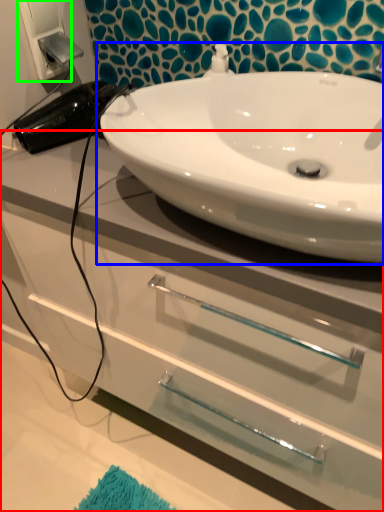
Question: Which object is positioned closest to bathroom cabinet (highlighted by a red box)? Select from sink (highlighted by a blue box) and electric outlet (highlighted by a green box).

Choices:
 (A) sink
 (B) electric outlet

Answer: (A)